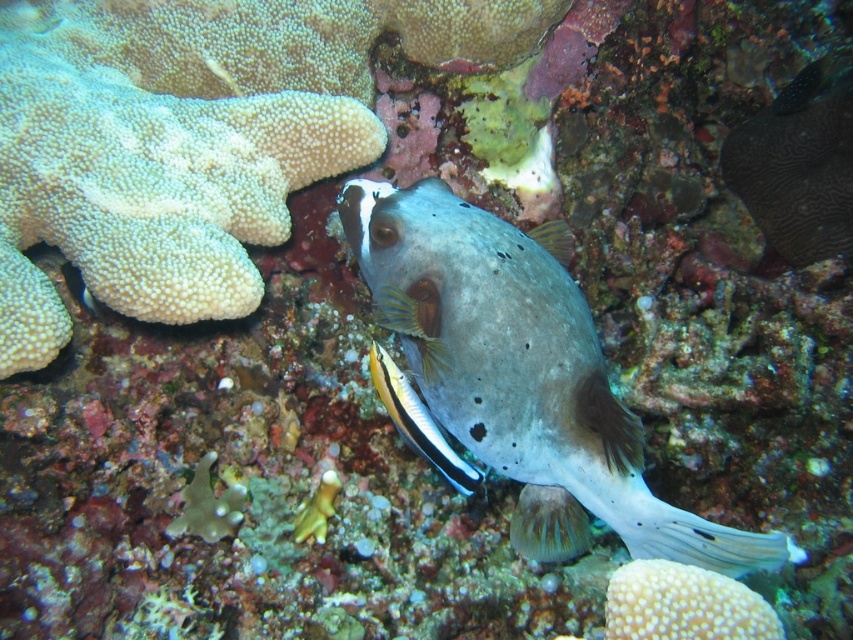
Question: Which point is closer to the camera?

Choices:
 (A) speckled gray pufferfish at center
 (B) shiny yellow and black fish at center

Answer: (A)

Question: From the image, what is the correct spatial relationship of speckled gray pufferfish at center in relation to shiny yellow and black fish at center?

Choices:
 (A) left
 (B) right

Answer: (B)

Question: Which object is closer to the camera taking this photo?

Choices:
 (A) shiny yellow and black fish at center
 (B) speckled gray pufferfish at center

Answer: (B)

Question: Among these objects, which one is nearest to the camera?

Choices:
 (A) speckled gray pufferfish at center
 (B) shiny yellow and black fish at center

Answer: (A)

Question: Does speckled gray pufferfish at center have a greater width compared to shiny yellow and black fish at center?

Choices:
 (A) yes
 (B) no

Answer: (A)

Question: Does speckled gray pufferfish at center have a lesser width compared to shiny yellow and black fish at center?

Choices:
 (A) no
 (B) yes

Answer: (A)